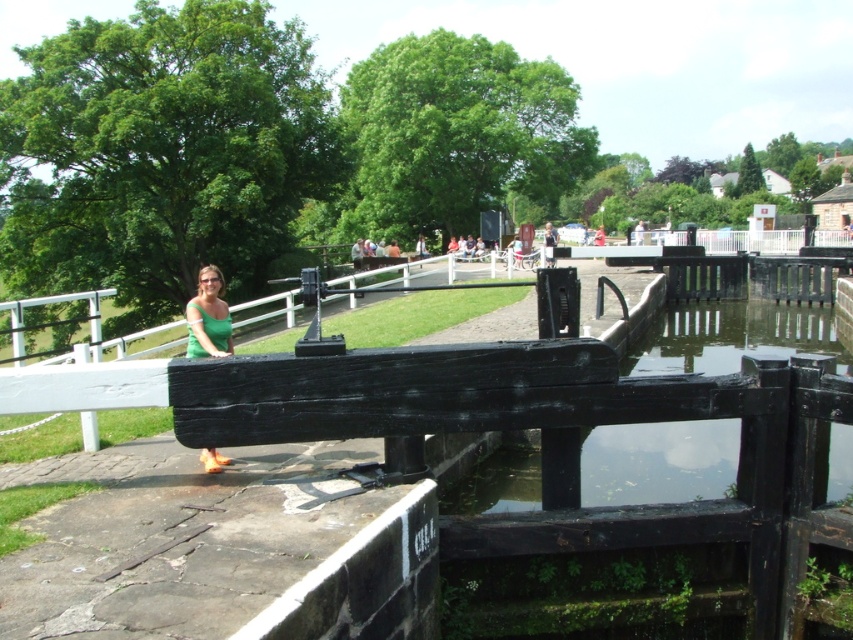
Question: Is transparent water at lock center to the left of green matte shirt at center from the viewer's perspective?

Choices:
 (A) yes
 (B) no

Answer: (B)

Question: Can you confirm if transparent water at lock center is thinner than green matte shirt at center?

Choices:
 (A) no
 (B) yes

Answer: (A)

Question: Is transparent water at lock center smaller than green matte shirt at center?

Choices:
 (A) no
 (B) yes

Answer: (B)

Question: Among these objects, which one is farthest from the camera?

Choices:
 (A) transparent water at lock center
 (B) green matte shirt at center

Answer: (B)